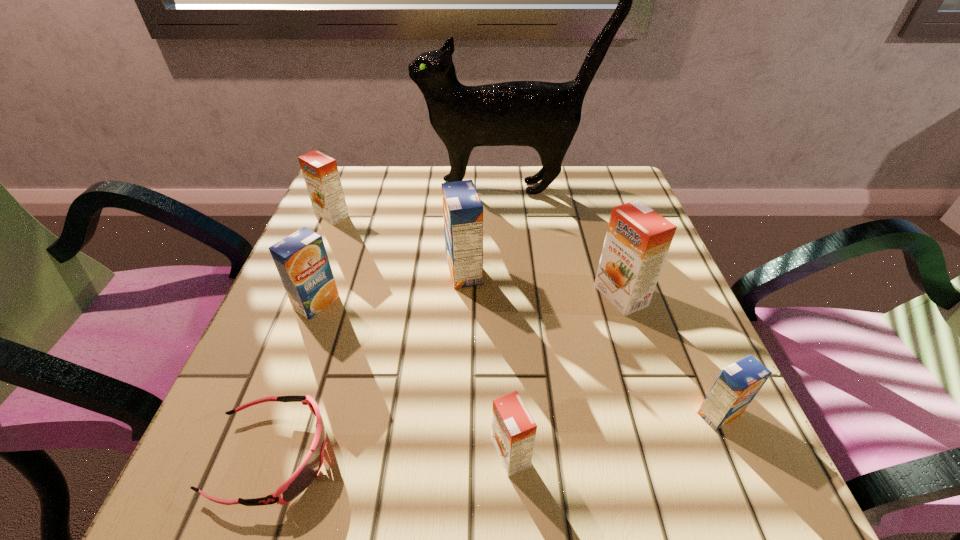
The height and width of the screenshot is (540, 960). What are the coordinates of `the smallest blue orange_juice` in the screenshot? It's located at (737, 385).

You are a GUI agent. You are given a task and a screenshot of the screen. Output one action in this format:
    pyautogui.click(x=<x>, y=<y>)
    Task: Click on the nearest orange juice
    The height and width of the screenshot is (540, 960).
    Given the screenshot: What is the action you would take?
    pyautogui.click(x=513, y=429)

The image size is (960, 540). I want to click on the third orange juice from right to left, so click(513, 429).

Where is `pink goggles`? pink goggles is located at coordinates (304, 475).

You are a GUI agent. You are given a task and a screenshot of the screen. Output one action in this format:
    pyautogui.click(x=<x>, y=<y>)
    Task: Click on the goggles
    This screenshot has height=540, width=960.
    Given the screenshot: What is the action you would take?
    pyautogui.click(x=304, y=475)

Locate an element on the screen. vacant space positioned 0.150m on the face of the black cat is located at coordinates (361, 188).

I want to click on vacant point located 0.150m on the face of the black cat, so click(x=361, y=188).

At what (x,y) coordinates should I click in order to perform the action: click on vacant space located 0.370m on the back of the second blue orange_juice from left to right. Please return your answer as a coordinate pair (x, y). Looking at the image, I should click on (468, 167).

This screenshot has height=540, width=960. Identify the location of free spot located 0.250m on the left of the rightmost orange orange juice. (464, 296).

You are a GUI agent. You are given a task and a screenshot of the screen. Output one action in this format:
    pyautogui.click(x=<x>, y=<y>)
    Task: Click on the vacant region located 0.180m on the front of the second biggest orange orange juice
    
    Given the screenshot: What is the action you would take?
    pyautogui.click(x=304, y=280)